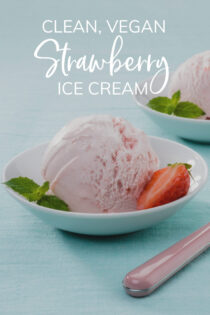
Locate an element on the screen. The image size is (210, 315). bowl is located at coordinates (97, 229).